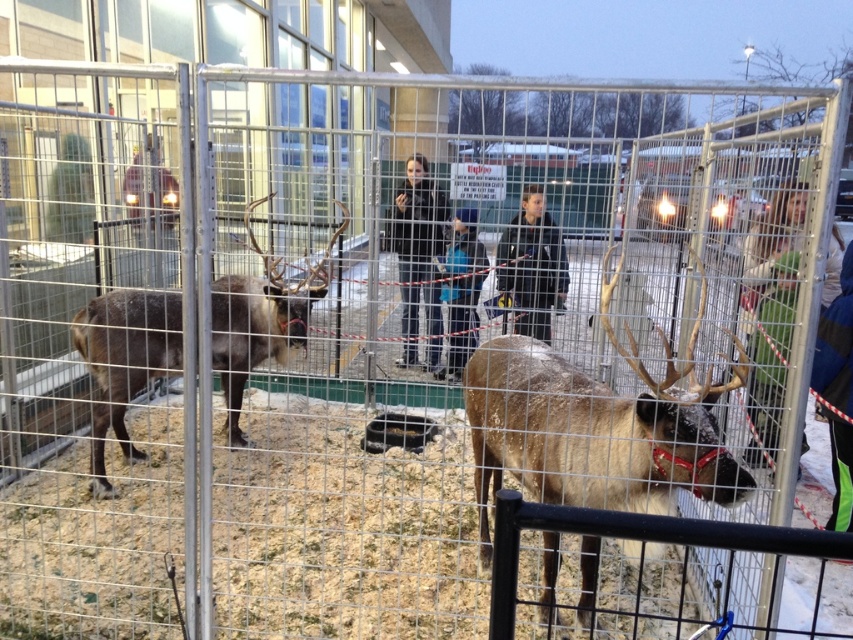
You are a visitor at the event and want to take a photo of both the green fabric coat at center and the black leather jacket at center. However, you notice that one is blocking the other. Which coat is currently blocking the view of the other?

The green fabric coat at center is in front of the black leather jacket at center, so it is blocking the view of the black leather jacket at center.

You are attending an outdoor event and see two coats hanging on a rack at the center of the enclosure. The coats are a green fabric coat at center and a black leather jacket at center. Which coat is bigger?

The green fabric coat at center is larger in size compared to the black leather jacket at center.

You are standing at the center of the enclosure. The brown fuzzy reindeer at left is at point 0.564, 0.147. If you want to approach it, in which direction should you move relative to your current position?

You should move towards the left direction to approach the brown fuzzy reindeer at left since it is located at point (125, 360) relative to your position at the center.